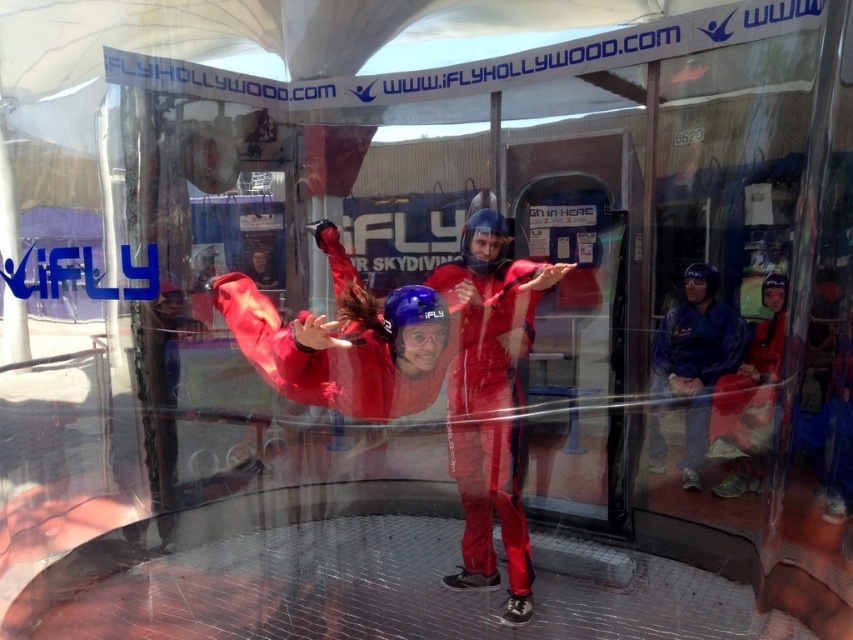
Question: Which object is farther from the camera taking this photo?

Choices:
 (A) matte blue helmet at upper right
 (B) blue fabric jacket at right
 (C) matte red jumpsuit at center

Answer: (B)

Question: Observing the image, what is the correct spatial positioning of matte red jumpsuit at center in reference to blue fabric jacket at right?

Choices:
 (A) below
 (B) above

Answer: (B)

Question: Does matte red jumpsuit at center come behind blue fabric jacket at right?

Choices:
 (A) no
 (B) yes

Answer: (A)

Question: Can you confirm if shiny red jumpsuit at center is positioned to the left of blue fabric jacket at right?

Choices:
 (A) yes
 (B) no

Answer: (A)

Question: Which is nearer to the shiny red jumpsuit at center?

Choices:
 (A) blue fabric jacket at right
 (B) matte red jumpsuit at center

Answer: (B)

Question: Which object appears closest to the camera in this image?

Choices:
 (A) blue fabric jacket at right
 (B) matte red jumpsuit at center
 (C) matte blue helmet at upper right
 (D) shiny red jumpsuit at center

Answer: (B)